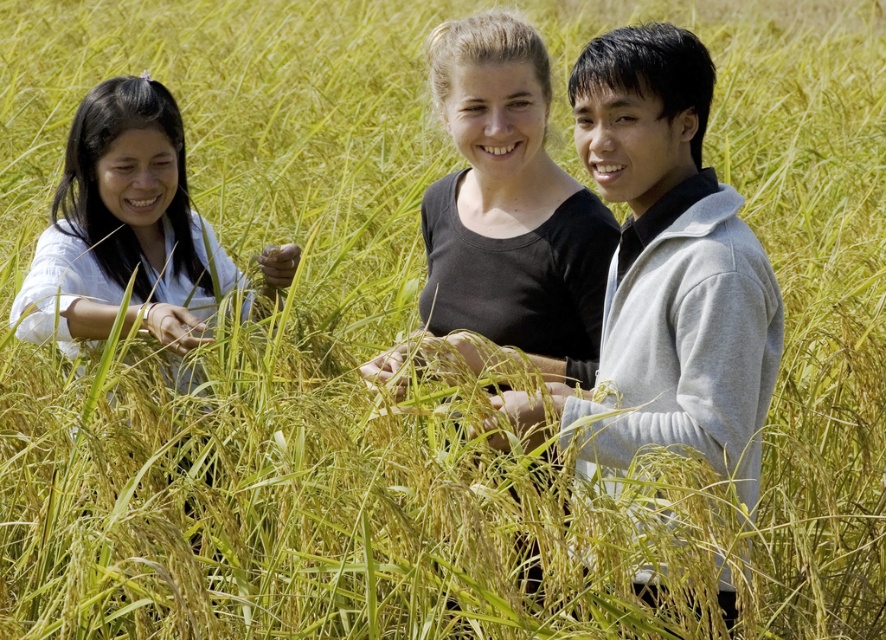
Question: Is gray fleece jacket at center to the right of light blue fabric at left from the viewer's perspective?

Choices:
 (A) no
 (B) yes

Answer: (B)

Question: Which object is the closest to the light blue fabric at left?

Choices:
 (A) black matte shirt at center
 (B) gray fleece jacket at center

Answer: (A)

Question: Is gray fleece jacket at center below light blue fabric at left?

Choices:
 (A) no
 (B) yes

Answer: (B)

Question: Is black matte shirt at center below light blue fabric at left?

Choices:
 (A) yes
 (B) no

Answer: (B)

Question: Which point appears farthest from the camera in this image?

Choices:
 (A) (522, 291)
 (B) (43, 332)
 (C) (717, 355)

Answer: (B)

Question: Which point is closer to the camera taking this photo?

Choices:
 (A) (68, 262)
 (B) (589, 324)

Answer: (B)